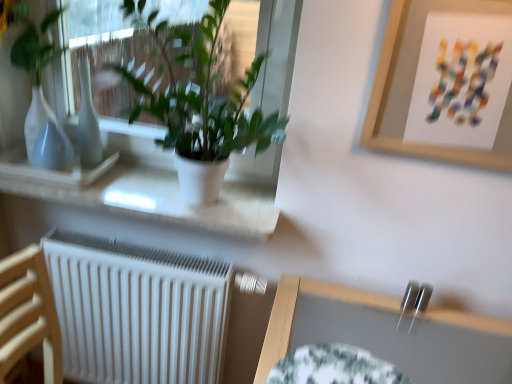
Identify the location of vacant area situated below white matte plant pot at upper left, acting as the 2th houseplant starting from the left (from a real-world perspective). The width and height of the screenshot is (512, 384). (185, 203).